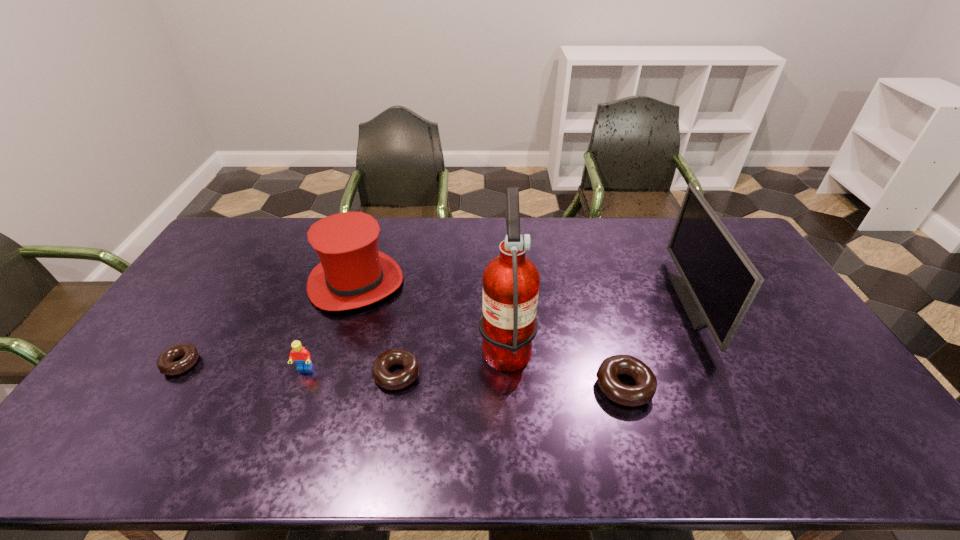
This screenshot has height=540, width=960. Find the location of `the shortest object`. the shortest object is located at coordinates (165, 364).

Where is `the shortest doughnut`? The height and width of the screenshot is (540, 960). the shortest doughnut is located at coordinates (165, 364).

Image resolution: width=960 pixels, height=540 pixels. I want to click on the sixth tallest object, so click(383, 377).

Find the location of `the second shortest doughnut`. the second shortest doughnut is located at coordinates (383, 377).

In order to click on the third shortest object in this screenshot , I will do `click(646, 383)`.

The image size is (960, 540). What are the coordinates of `the tallest doughnut` in the screenshot? It's located at (646, 383).

Find the location of a particular element. The image size is (960, 540). the third object from right to left is located at coordinates tap(508, 325).

In order to click on fire extinguisher in this screenshot , I will do `click(508, 325)`.

The height and width of the screenshot is (540, 960). In order to click on monitor in this screenshot , I will do `click(719, 282)`.

Locate an element on the screen. The image size is (960, 540). the sixth shortest object is located at coordinates (719, 282).